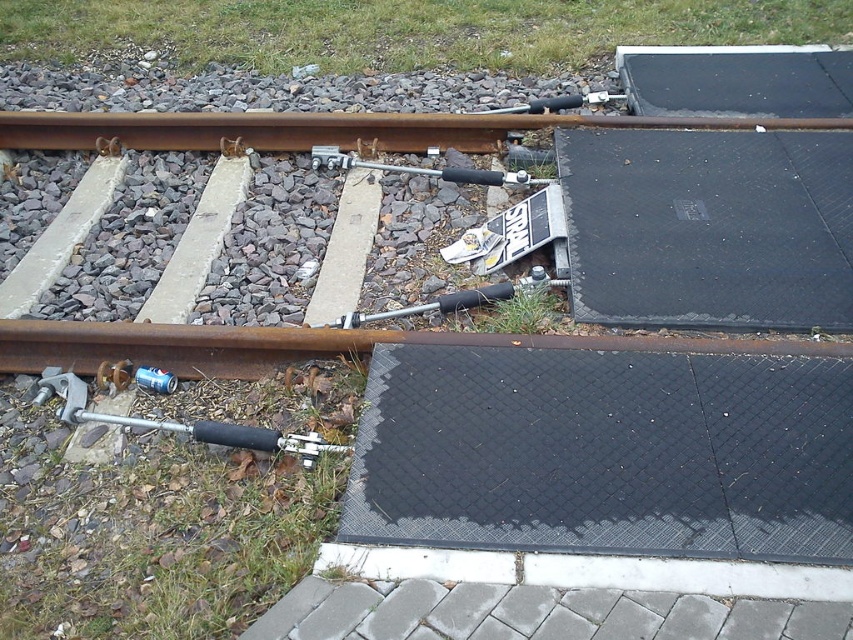
Question: Estimate the real-world distances between objects in this image. Which object is closer to the rusty metal train track at lower center?

Choices:
 (A) rusty metal train track at upper center
 (B) metallic silver tool at lower left
 (C) black rubber mat at lower right

Answer: (B)

Question: Does rusty metal train track at upper center have a smaller size compared to metallic silver tool at lower left?

Choices:
 (A) no
 (B) yes

Answer: (A)

Question: Which of the following is the farthest from the observer?

Choices:
 (A) (326, 138)
 (B) (186, 432)
 (C) (648, 344)

Answer: (A)

Question: From the image, what is the correct spatial relationship of black rubber mat at lower right in relation to metallic silver tool at lower left?

Choices:
 (A) left
 (B) right

Answer: (B)

Question: Considering the real-world distances, which object is closest to the rusty metal train track at lower center?

Choices:
 (A) rusty metal train track at upper center
 (B) black rubber mat at lower right

Answer: (B)

Question: Considering the relative positions of rusty metal train track at upper center and metallic silver tool at lower left in the image provided, where is rusty metal train track at upper center located with respect to metallic silver tool at lower left?

Choices:
 (A) above
 (B) below

Answer: (A)